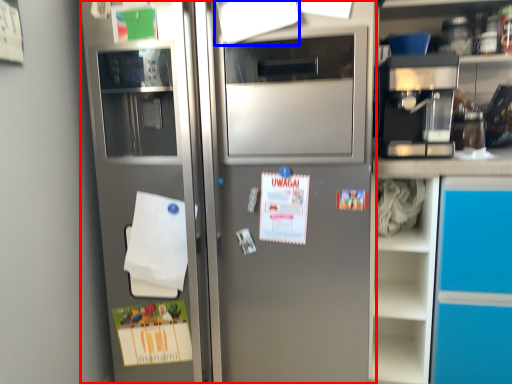
Question: Which object appears farthest to the camera in this image, refrigerator (highlighted by a red box) or paper (highlighted by a blue box)?

Choices:
 (A) refrigerator
 (B) paper

Answer: (B)